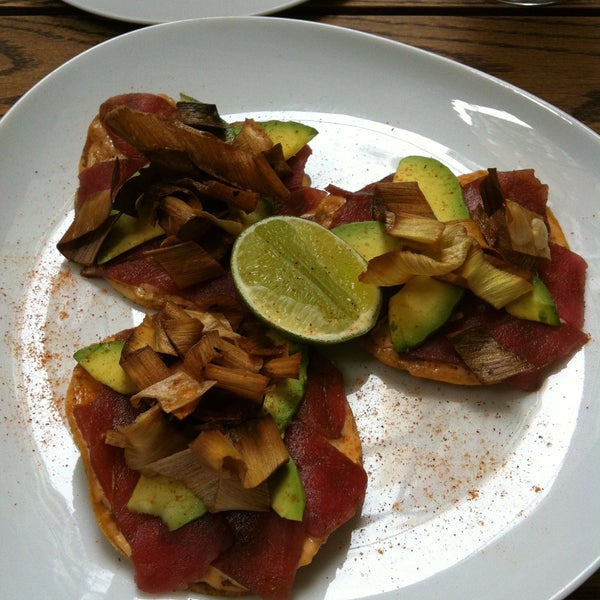
You are a GUI agent. You are given a task and a screenshot of the screen. Output one action in this format:
    pyautogui.click(x=<x>, y=<y>)
    Task: Click on the plate
    The width and height of the screenshot is (600, 600).
    Given the screenshot: What is the action you would take?
    pyautogui.click(x=188, y=5), pyautogui.click(x=350, y=127)